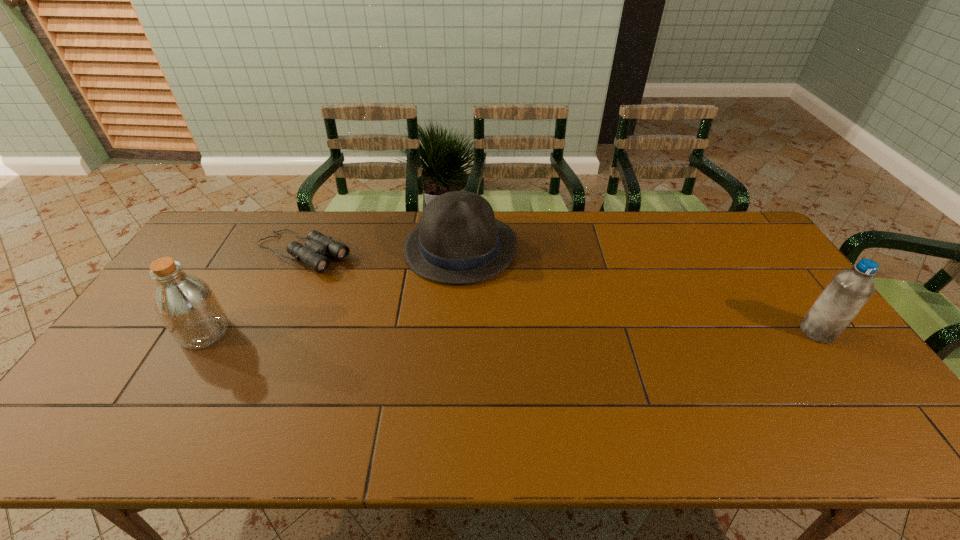
At what (x,y) coordinates should I click in order to perform the action: click on vacant space at the right edge of the desktop. Please return your answer as a coordinate pair (x, y). The image size is (960, 540). Looking at the image, I should click on (765, 265).

Image resolution: width=960 pixels, height=540 pixels. What are the coordinates of `vacant point at the near right corner` in the screenshot? It's located at (840, 403).

At what (x,y) coordinates should I click in order to perform the action: click on free point between the rightmost object and the bottle. Please return your answer as a coordinate pair (x, y). The height and width of the screenshot is (540, 960). Looking at the image, I should click on (511, 332).

The width and height of the screenshot is (960, 540). I want to click on vacant space in between the bottle and the shortest object, so click(253, 293).

I want to click on free space between the bowler hat and the bottle, so click(333, 290).

Find the location of a particular element. The width and height of the screenshot is (960, 540). free spot between the bowler hat and the bottle is located at coordinates (333, 290).

Locate an element on the screen. Image resolution: width=960 pixels, height=540 pixels. empty space between the shortest object and the third tallest object is located at coordinates 382,251.

Locate an element on the screen. free spot between the binoculars and the second object from right to left is located at coordinates pos(382,251).

Find the location of a particular element. empty space between the shortest object and the water bottle is located at coordinates (560, 293).

Image resolution: width=960 pixels, height=540 pixels. I want to click on empty space between the third tallest object and the binoculars, so click(382, 251).